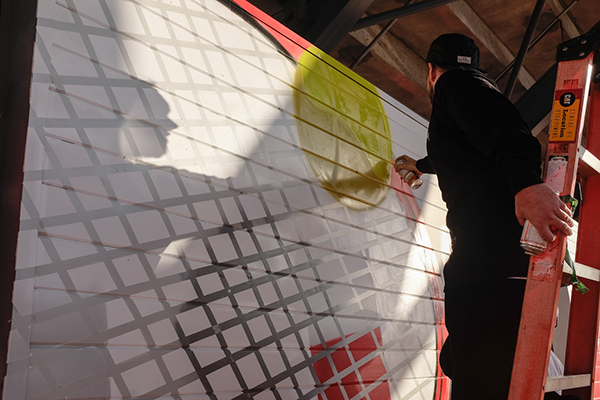
This screenshot has width=600, height=400. I want to click on wall being sprayed painted with art, so click(x=152, y=253).